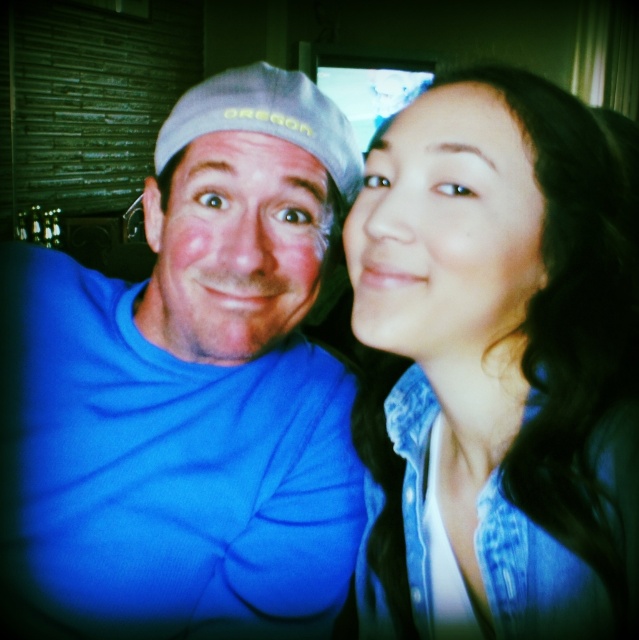
Can you confirm if matte blue shirt at left is positioned to the left of gray fabric cap at upper left?

Correct, you'll find matte blue shirt at left to the left of gray fabric cap at upper left.

Does matte blue shirt at left have a lesser height compared to gray fabric cap at upper left?

In fact, matte blue shirt at left may be taller than gray fabric cap at upper left.

Locate an element on the screen. matte blue shirt at left is located at coordinates (233, 246).

Which is more to the right, blue fabric shirt at center or gray fabric cap at upper left?

From the viewer's perspective, gray fabric cap at upper left appears more on the right side.

Does blue fabric shirt at center appear under gray fabric cap at upper left?

Correct, blue fabric shirt at center is located below gray fabric cap at upper left.

What do you see at coordinates (185, 388) in the screenshot?
I see `blue fabric shirt at center` at bounding box center [185, 388].

You are a GUI agent. You are given a task and a screenshot of the screen. Output one action in this format:
    pyautogui.click(x=<x>, y=<y>)
    Task: Click on the blue fabric shirt at center
    This screenshot has width=639, height=640.
    Given the screenshot: What is the action you would take?
    pyautogui.click(x=185, y=388)

Does blue fabric shirt at center appear under matte blue shirt at left?

Yes.

Who is lower down, blue fabric shirt at center or matte blue shirt at left?

blue fabric shirt at center is lower down.

Is point (158, 381) positioned behind point (171, 220)?

Yes, it is behind point (171, 220).

Where is `blue fabric shirt at center`? The width and height of the screenshot is (639, 640). blue fabric shirt at center is located at coordinates (185, 388).